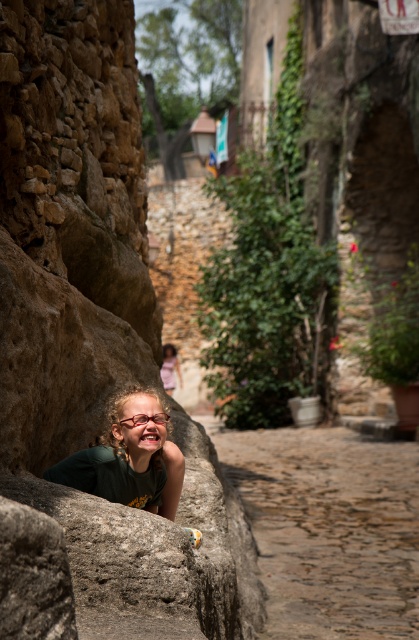
You are a photographer trying to capture a shot of the green fabric face at lower left and the matte pink dress at center in the village scene. How far apart are these two elements in the image?

The green fabric face at lower left and the matte pink dress at center are 13.71 meters apart.

You are a photographer trying to capture the girl hiding behind the brown rough stone at lower left and the green fabric face at lower left. Which object should you focus on first if you want to include both in your shot without moving the camera?

You should focus on the brown rough stone at lower left first because it is larger in size compared to the green fabric face at lower left, allowing it to be more prominently featured in the frame while still including the smaller green fabric face at lower left.

You are a photographer trying to capture the girl hiding behind the brown rough stone at lower left and the green fabric face at lower left. Which object should you focus on first if you want to ensure both are in focus without adjusting your camera settings?

The brown rough stone at lower left has a greater height compared to the green fabric face at lower left, so focusing on the brown rough stone at lower left first would ensure both are in focus since it is closer to the camera.